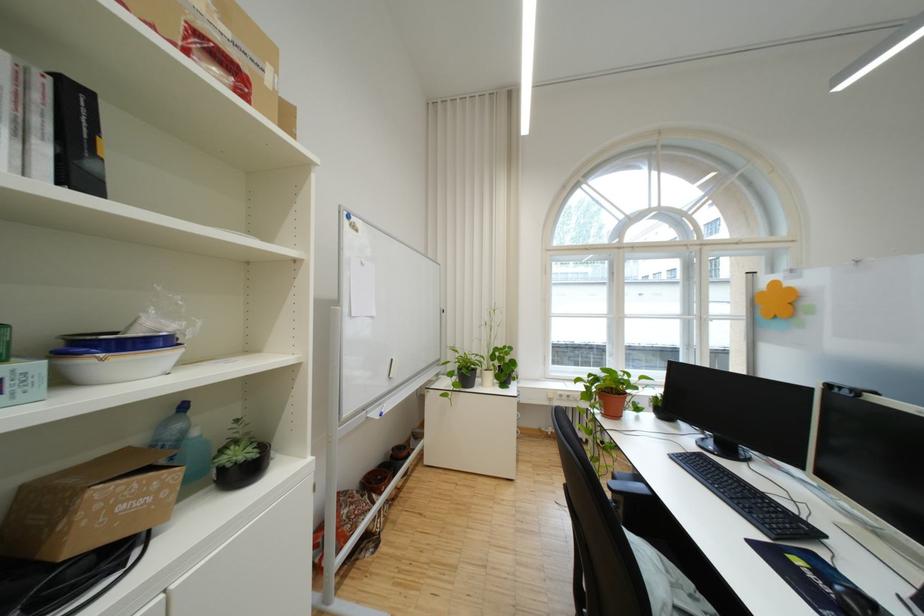
Find where to click the black computer mouse. Please return your answer as a coordinate pair (x, y).

(854, 600)